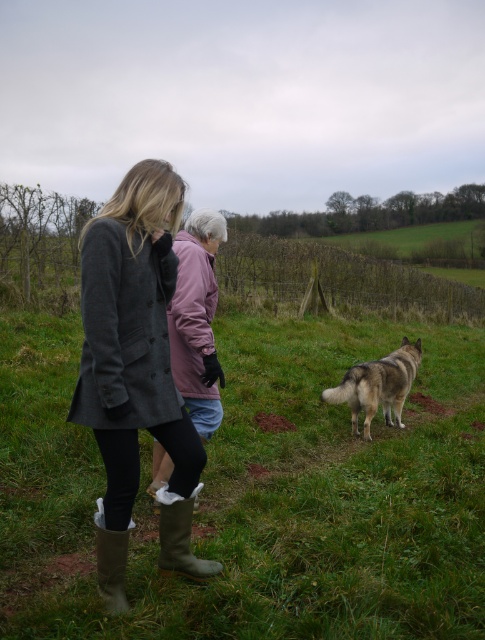
Is green grassy field at center closer to the viewer compared to brown suede boot at lower left?

→ Yes, green grassy field at center is closer to the viewer.

Which is below, green grassy field at center or brown suede boot at lower left?

brown suede boot at lower left is below.

Locate an element on the screen. This screenshot has width=485, height=640. green grassy field at center is located at coordinates (258, 493).

The width and height of the screenshot is (485, 640). In order to click on green grassy field at center in this screenshot , I will do `click(258, 493)`.

Does point (84, 435) lie behind point (124, 531)?

That is True.

Can you confirm if green grassy field at center is bigger than green rubber boot at lower left?

Indeed, green grassy field at center has a larger size compared to green rubber boot at lower left.

I want to click on green grassy field at center, so click(x=258, y=493).

Between green grassy field at center and dark gray wool coat at center, which one is positioned lower?

dark gray wool coat at center is lower down.

Who is more forward, (413, 616) or (131, 403)?

Point (131, 403)

Where is `green grassy field at center`? green grassy field at center is located at coordinates (258, 493).